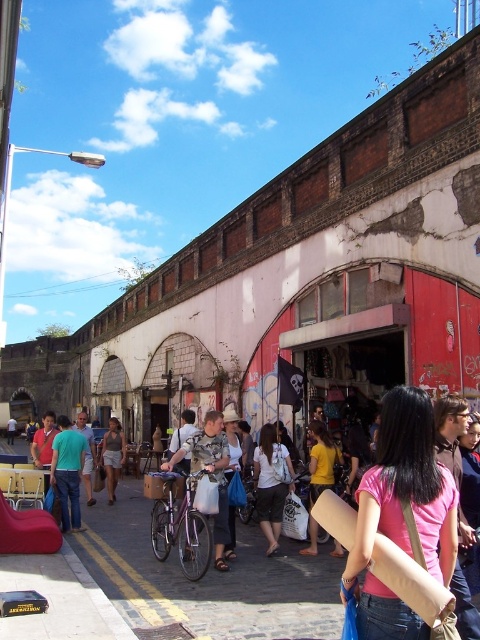
Question: Which object is closer to the camera taking this photo?

Choices:
 (A) pink matte shirt at center
 (B) matte green shirt at center
 (C) white cotton shirt at center
 (D) yellow matte shirt at center

Answer: (A)

Question: Can you confirm if yellow matte shirt at center is positioned to the left of light brown leather jacket at center?

Choices:
 (A) yes
 (B) no

Answer: (B)

Question: Based on their relative distances, which object is farther from the pink matte shirt at center?

Choices:
 (A) light gray cotton shirt at center
 (B) yellow matte shirt at center
 (C) white cotton shirt at center

Answer: (A)

Question: Observing the image, what is the correct spatial positioning of yellow matte shirt at center in reference to green cotton shirt at center?

Choices:
 (A) above
 (B) below

Answer: (A)

Question: Does pink matte shirt at center have a smaller size compared to yellow matte shirt at center?

Choices:
 (A) yes
 (B) no

Answer: (A)

Question: Which of the following is the closest to the observer?

Choices:
 (A) white cotton shirt at center
 (B) matte green shirt at center

Answer: (A)